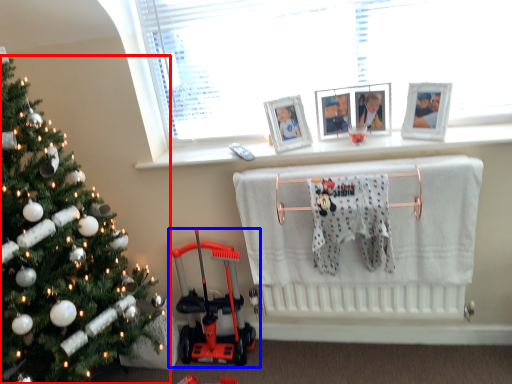
Question: Which object appears closest to the camera in this image, christmas tree (highlighted by a red box) or toy (highlighted by a blue box)?

Choices:
 (A) christmas tree
 (B) toy

Answer: (A)